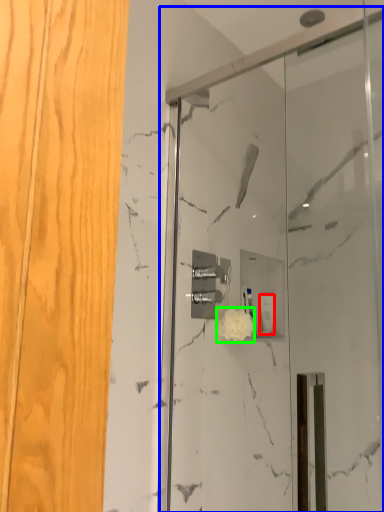
Question: Which object is the closest to the toiletry (highlighted by a red box)? Choose among these: screen door (highlighted by a blue box) or flower (highlighted by a green box).

Choices:
 (A) screen door
 (B) flower

Answer: (B)